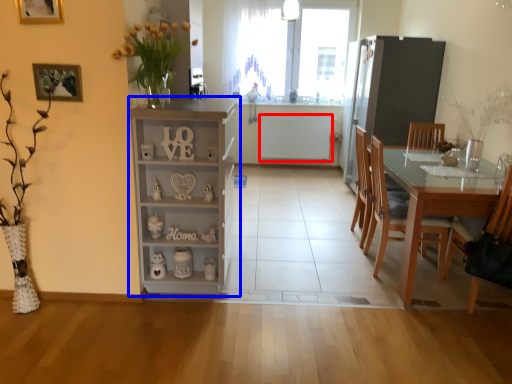
Question: Which of the following is the farthest to the observer, appliance (highlighted by a red box) or cabinetry (highlighted by a blue box)?

Choices:
 (A) appliance
 (B) cabinetry

Answer: (A)